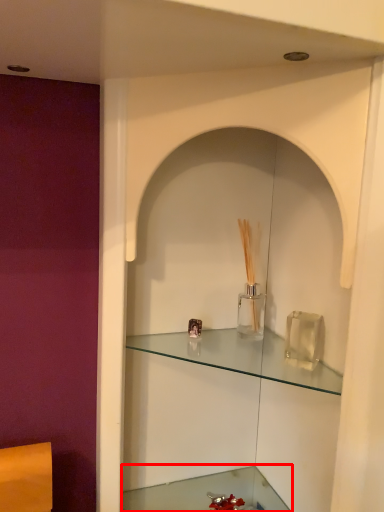
Question: From the image's perspective, what is the correct spatial positioning of cabinetry (annotated by the red box) in reference to shelf?

Choices:
 (A) above
 (B) below

Answer: (B)